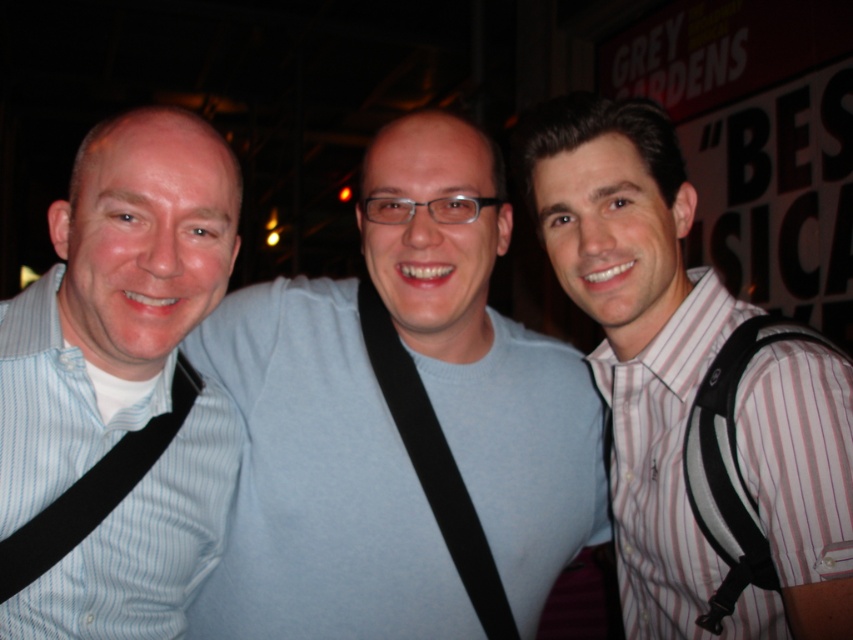
Based on the scene description, can you determine which object is positioned higher between the light blue sweater at center and the striped cotton shirt at right?

The light blue sweater at center is positioned higher than the striped cotton shirt at right according to the description.